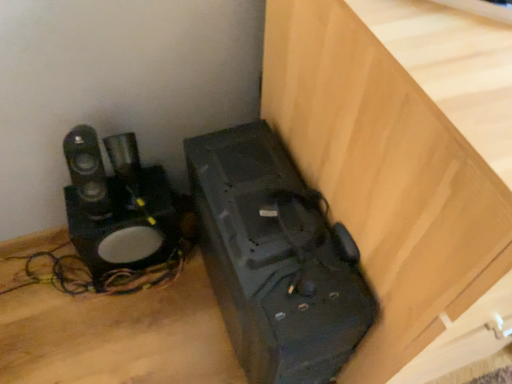
Question: Would you say black plastic speaker at lower left is to the left or to the right of matte black speaker at lower right in the picture?

Choices:
 (A) right
 (B) left

Answer: (A)

Question: Is black plastic speaker at lower left bigger or smaller than matte black speaker at lower right?

Choices:
 (A) big
 (B) small

Answer: (A)

Question: Is black plastic speaker at lower left situated inside matte black speaker at lower right or outside?

Choices:
 (A) outside
 (B) inside

Answer: (A)

Question: In terms of height, does matte black speaker at lower right look taller or shorter compared to black plastic speaker at lower left?

Choices:
 (A) short
 (B) tall

Answer: (A)

Question: Which is correct: matte black speaker at lower right is inside black plastic speaker at lower left, or outside of it?

Choices:
 (A) outside
 (B) inside

Answer: (A)

Question: Based on their sizes in the image, would you say matte black speaker at lower right is bigger or smaller than black plastic speaker at lower left?

Choices:
 (A) big
 (B) small

Answer: (B)

Question: Considering the positions of matte black speaker at lower right and black plastic speaker at lower left in the image, is matte black speaker at lower right wider or thinner than black plastic speaker at lower left?

Choices:
 (A) wide
 (B) thin

Answer: (B)